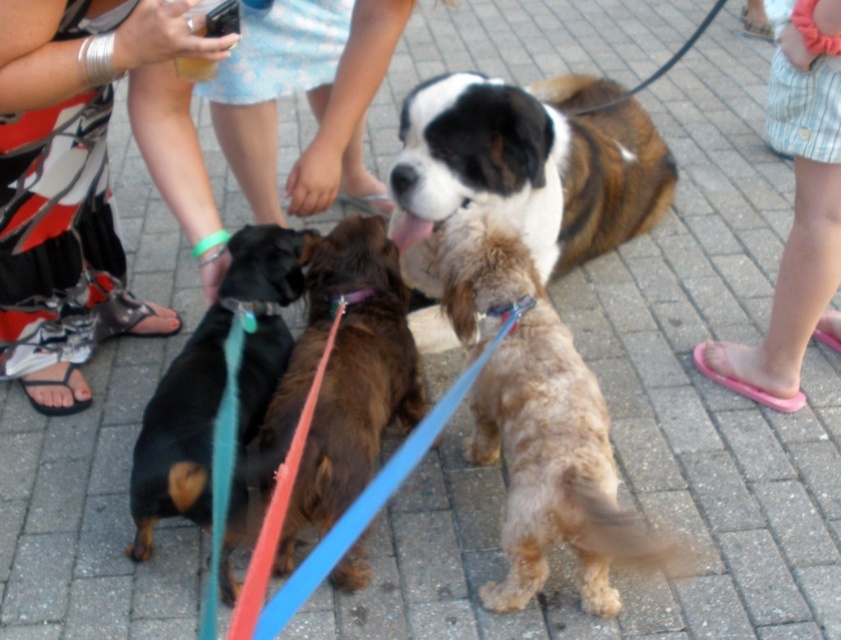
Question: Among these points, which one is nearest to the camera?

Choices:
 (A) (537, 278)
 (B) (160, 93)

Answer: (B)

Question: Estimate the real-world distances between objects in this image. Which object is farther from the light blue denim shorts at center?

Choices:
 (A) brown/white fur at center
 (B) pink flip-flops at lower right

Answer: (B)

Question: Is brown shaggy dog at center bigger than brown fuzzy dog at center?

Choices:
 (A) yes
 (B) no

Answer: (A)

Question: Is brown shaggy dog at center wider than brown fuzzy dog at center?

Choices:
 (A) no
 (B) yes

Answer: (B)

Question: Does light blue denim shorts at center appear over brown fuzzy dog at center?

Choices:
 (A) no
 (B) yes

Answer: (B)

Question: Which object is the closest to the brown shaggy dog at center?

Choices:
 (A) light blue denim shorts at center
 (B) brown fuzzy dog at center
 (C) metallic silver sandals at lower left
 (D) black smooth dachshund at left

Answer: (B)